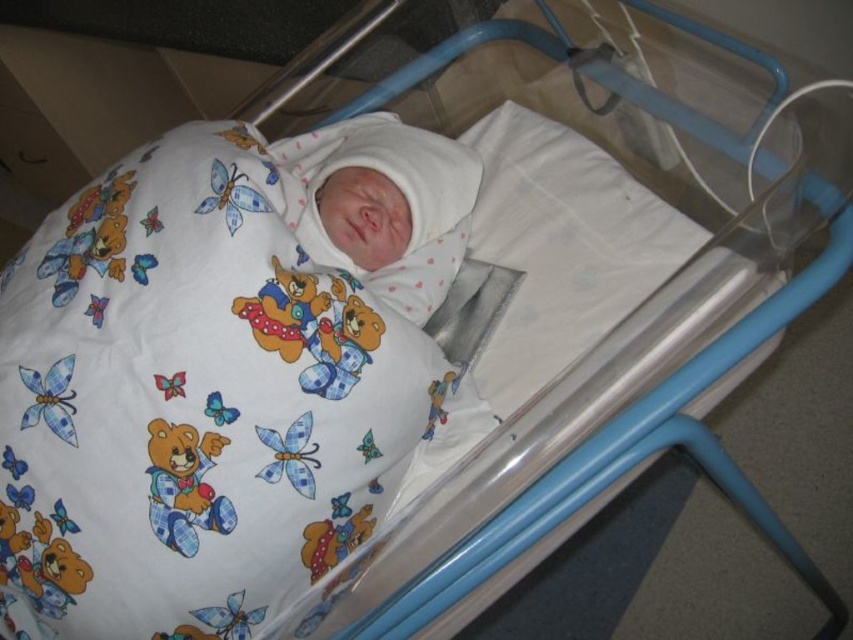
Between white fabric with teddy bear print at center and white cotton swaddle at center, which one has more height?

white fabric with teddy bear print at center

How much distance is there between white fabric with teddy bear print at center and white cotton swaddle at center?

The distance of white fabric with teddy bear print at center from white cotton swaddle at center is 4.66 inches.

The image size is (853, 640). I want to click on white fabric with teddy bear print at center, so click(218, 376).

This screenshot has width=853, height=640. I want to click on white fabric with teddy bear print at center, so click(x=218, y=376).